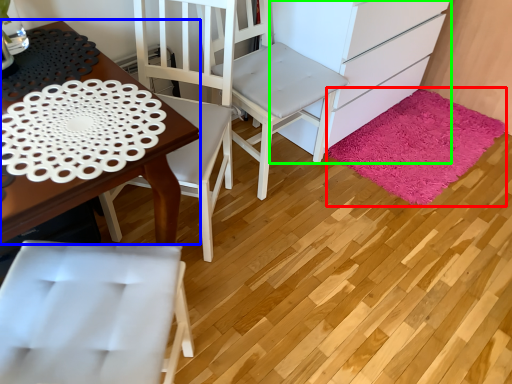
Question: Which is nearer to the mat (highlighted by a red box)? desk (highlighted by a blue box) or cabinetry (highlighted by a green box).

Choices:
 (A) desk
 (B) cabinetry

Answer: (B)